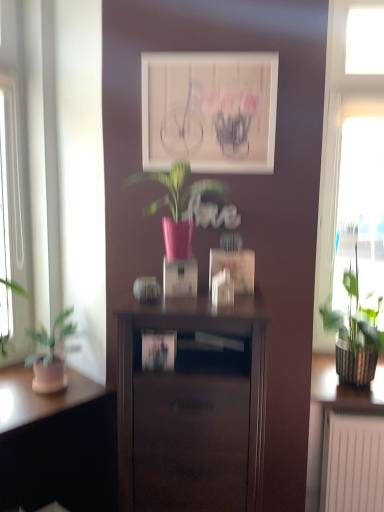
Question: Considering the relative positions of green textured plant at right, which is counted as the 2th houseplant, starting from the front, and matte white picture frame at center in the image provided, is green textured plant at right, which is counted as the 2th houseplant, starting from the front, to the left of matte white picture frame at center from the viewer's perspective?

Choices:
 (A) no
 (B) yes

Answer: (A)

Question: Does green textured plant at right, which is counted as the 2th houseplant, starting from the front, have a lesser height compared to matte white picture frame at center?

Choices:
 (A) yes
 (B) no

Answer: (B)

Question: Is matte white picture frame at center surrounded by green textured plant at right, placed as the 2th houseplant when sorted from top to bottom?

Choices:
 (A) no
 (B) yes

Answer: (A)

Question: From a real-world perspective, is green textured plant at right, placed as the 2th houseplant when sorted from top to bottom, positioned under matte white picture frame at center based on gravity?

Choices:
 (A) no
 (B) yes

Answer: (B)

Question: Can you see green textured plant at right, which is counted as the 2th houseplant, starting from the front, touching matte white picture frame at center?

Choices:
 (A) no
 (B) yes

Answer: (A)

Question: From a real-world perspective, relative to green textured plant at right, which is counted as the 2th houseplant, starting from the front, is matte white picture frame at center vertically above or below?

Choices:
 (A) below
 (B) above

Answer: (B)

Question: Considering their positions, is matte white picture frame at center located in front of or behind green textured plant at right, which appears as the 1th houseplant when viewed from the back?

Choices:
 (A) front
 (B) behind

Answer: (A)

Question: From the image's perspective, is matte white picture frame at center positioned above or below green textured plant at right, which appears as the 1th houseplant when viewed from the back?

Choices:
 (A) below
 (B) above

Answer: (B)

Question: Based on their sizes in the image, would you say matte white picture frame at center is bigger or smaller than green textured plant at right, the 1th houseplant viewed from the right?

Choices:
 (A) small
 (B) big

Answer: (A)

Question: Considering the positions of transparent glass window at right and pink glossy vase at center, positioned as the 1th houseplant in front-to-back order, in the image, is transparent glass window at right wider or thinner than pink glossy vase at center, positioned as the 1th houseplant in front-to-back order,?

Choices:
 (A) thin
 (B) wide

Answer: (A)

Question: Relative to pink glossy vase at center, placed as the 1th houseplant when sorted from left to right, is transparent glass window at right in front or behind?

Choices:
 (A) behind
 (B) front

Answer: (A)

Question: Is transparent glass window at right taller or shorter than pink glossy vase at center, the 2th houseplant when ordered from right to left?

Choices:
 (A) short
 (B) tall

Answer: (B)

Question: Would you say transparent glass window at right is to the left or to the right of pink glossy vase at center, positioned as the 1th houseplant in front-to-back order, in the picture?

Choices:
 (A) left
 (B) right

Answer: (B)

Question: Is transparent glass window at right in front of or behind matte white picture frame at center in the image?

Choices:
 (A) behind
 (B) front

Answer: (A)

Question: From a real-world perspective, relative to matte white picture frame at center, is transparent glass window at right vertically above or below?

Choices:
 (A) below
 (B) above

Answer: (A)